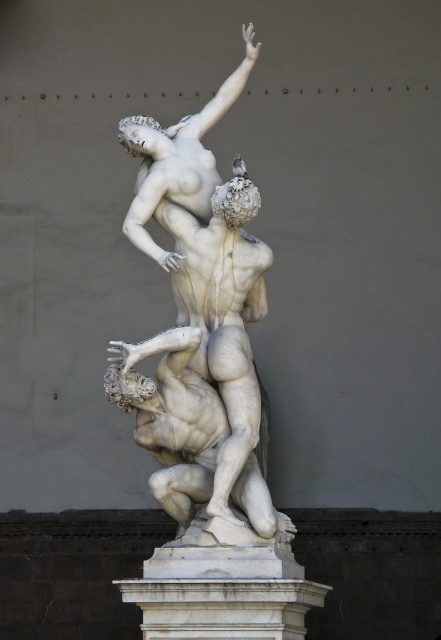
Can you confirm if white marble statue at center is positioned to the right of white marble pedestal at center?

Indeed, white marble statue at center is positioned on the right side of white marble pedestal at center.

Between point (183, 480) and point (185, 627), which one is positioned behind?

Point (183, 480)

Identify the location of white marble statue at center. Image resolution: width=441 pixels, height=640 pixels. (171, 417).

The image size is (441, 640). Describe the element at coordinates (201, 324) in the screenshot. I see `white marble sculpture at center` at that location.

Does white marble sculpture at center have a greater width compared to white marble pedestal at center?

Yes.

Between point (232, 400) and point (231, 570), which one is positioned in front?

Point (231, 570)

Where is `white marble sculpture at center`? This screenshot has width=441, height=640. white marble sculpture at center is located at coordinates (201, 324).

Identify the location of white marble sculpture at center. (201, 324).

Can you confirm if white marble sculpture at center is bigger than white marble statue at upper center?

Indeed, white marble sculpture at center has a larger size compared to white marble statue at upper center.

Who is more forward, (246, 51) or (120, 124)?

Point (120, 124) is in front.

Identify the location of white marble sculpture at center. This screenshot has height=640, width=441. (201, 324).